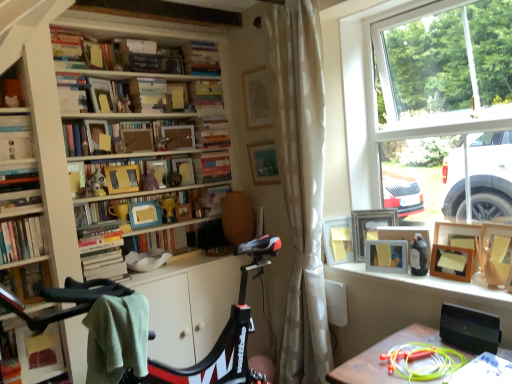
Question: Is hardcover books at center-left, the 2th book in the bottom-to-top sequence, located outside hardcover book at left, acting as the 8th book starting from the top?

Choices:
 (A) yes
 (B) no

Answer: (A)

Question: From the image's perspective, does hardcover books at center-left, which is the twelfth book from top to bottom, appear lower than hardcover book at left, acting as the 8th book starting from the top?

Choices:
 (A) yes
 (B) no

Answer: (A)

Question: From a real-world perspective, is hardcover books at center-left, which is the twelfth book from top to bottom, on hardcover book at left, acting as the 8th book starting from the top?

Choices:
 (A) no
 (B) yes

Answer: (A)

Question: Is hardcover books at center-left, which is the twelfth book from top to bottom, facing towards hardcover book at left, acting as the 8th book starting from the top?

Choices:
 (A) yes
 (B) no

Answer: (B)

Question: Can you see hardcover books at center-left, which is the twelfth book from top to bottom, touching hardcover book at left, acting as the 8th book starting from the top?

Choices:
 (A) yes
 (B) no

Answer: (B)

Question: From a real-world perspective, is green fabric desk at lower right positioned above or below wooden picture frame at upper center, which is counted as the 2th picture frame, starting from the left?

Choices:
 (A) below
 (B) above

Answer: (A)

Question: Considering the relative positions of green fabric desk at lower right and wooden picture frame at upper center, marked as the 5th picture frame in a right-to-left arrangement, in the image provided, is green fabric desk at lower right to the left or to the right of wooden picture frame at upper center, marked as the 5th picture frame in a right-to-left arrangement,?

Choices:
 (A) right
 (B) left

Answer: (A)

Question: Relative to wooden picture frame at upper center, which is counted as the 2th picture frame, starting from the left, is green fabric desk at lower right in front or behind?

Choices:
 (A) behind
 (B) front

Answer: (B)

Question: Is point (420, 329) closer or farther from the camera than point (256, 173)?

Choices:
 (A) closer
 (B) farther

Answer: (A)

Question: In the image, is wooden picture frame at window, which is counted as the 2th picture frame, starting from the right, on the left side or the right side of matte wooden picture frame at upper center, positioned as the first picture frame in left-to-right order?

Choices:
 (A) right
 (B) left

Answer: (A)

Question: Relative to matte wooden picture frame at upper center, which is the sixth picture frame in right-to-left order, is wooden picture frame at window, which is counted as the 2th picture frame, starting from the right, in front or behind?

Choices:
 (A) behind
 (B) front

Answer: (B)

Question: Does point (434, 253) appear closer or farther from the camera than point (254, 77)?

Choices:
 (A) closer
 (B) farther

Answer: (A)

Question: From a real-world perspective, is wooden picture frame at window, which is counted as the 2th picture frame, starting from the right, physically located above or below matte wooden picture frame at upper center, positioned as the first picture frame in left-to-right order?

Choices:
 (A) above
 (B) below

Answer: (B)

Question: Is white dotted fabric curtain at center to the left or to the right of green fabric desk at lower right in the image?

Choices:
 (A) left
 (B) right

Answer: (A)

Question: Does point (309, 269) appear closer or farther from the camera than point (347, 375)?

Choices:
 (A) farther
 (B) closer

Answer: (A)